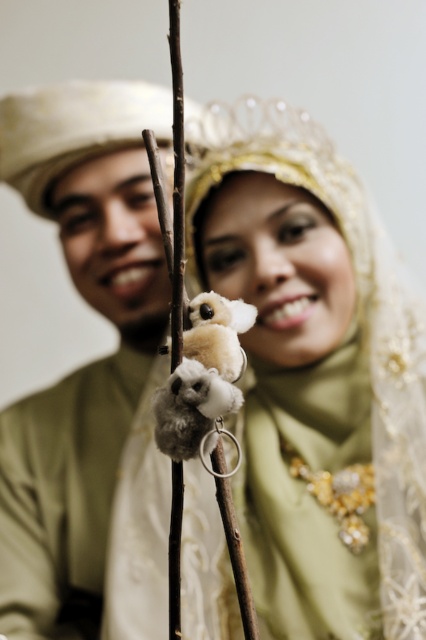
Who is positioned more to the left, matte green scarf at center or matte gold turban at left?

From the viewer's perspective, matte gold turban at left appears more on the left side.

Is matte green scarf at center bigger than matte gold turban at left?

Indeed, matte green scarf at center has a larger size compared to matte gold turban at left.

Where is `matte green scarf at center`? The image size is (426, 640). matte green scarf at center is located at coordinates (317, 378).

Which of these two, matte green scarf at center or fluffy white and gray plush toy at center, stands shorter?

With less height is fluffy white and gray plush toy at center.

Which is in front, point (279, 636) or point (198, 397)?

Positioned in front is point (198, 397).

Find the location of `matte green scarf at center`. matte green scarf at center is located at coordinates (317, 378).

At what (x,y) coordinates should I click in order to perform the action: click on matte gold turban at left. Please return your answer as a coordinate pair (x, y). The height and width of the screenshot is (640, 426). Looking at the image, I should click on (89, 364).

Is point (25, 572) behind point (226, 362)?

Yes.

Locate an element on the screen. The height and width of the screenshot is (640, 426). matte gold turban at left is located at coordinates (89, 364).